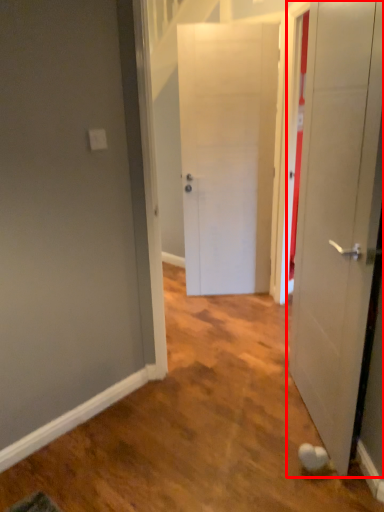
Question: From the image's perspective, what is the correct spatial relationship of door (annotated by the red box) in relation to door?

Choices:
 (A) below
 (B) above

Answer: (A)